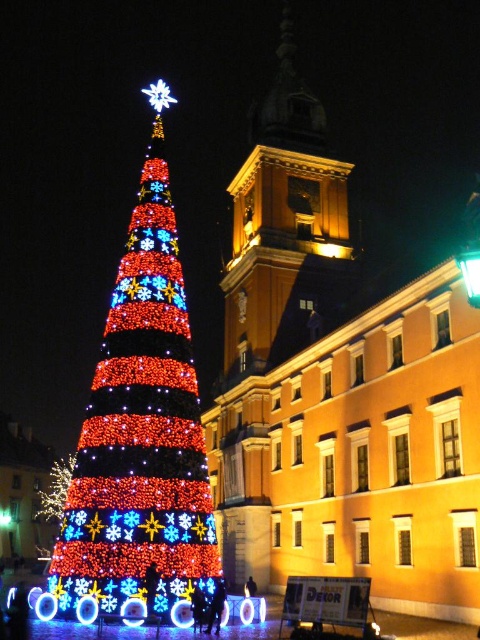
Measure the distance between golden stone bell tower at upper center and illuminated plastic tree at center.

golden stone bell tower at upper center and illuminated plastic tree at center are 66.75 meters apart from each other.

The height and width of the screenshot is (640, 480). Describe the element at coordinates (286, 227) in the screenshot. I see `golden stone bell tower at upper center` at that location.

You are a GUI agent. You are given a task and a screenshot of the screen. Output one action in this format:
    pyautogui.click(x=<x>, y=<y>)
    Task: Click on the golden stone bell tower at upper center
    The width and height of the screenshot is (480, 640).
    Given the screenshot: What is the action you would take?
    pyautogui.click(x=286, y=227)

Image resolution: width=480 pixels, height=640 pixels. What do you see at coordinates (141, 432) in the screenshot?
I see `illuminated fabric christmas tree at left` at bounding box center [141, 432].

From the picture: Does illuminated fabric christmas tree at left appear under illuminated plastic tree at center?

No.

Which is behind, point (140, 500) or point (48, 502)?

Positioned behind is point (48, 502).

Where is `illuminated fabric christmas tree at left`? Image resolution: width=480 pixels, height=640 pixels. illuminated fabric christmas tree at left is located at coordinates (141, 432).

Between point (141, 273) and point (288, 289), which one is positioned in front?

Point (141, 273) is more forward.

Between illuminated fabric christmas tree at left and golden stone bell tower at upper center, which one has less height?

illuminated fabric christmas tree at left

Which is in front, point (171, 544) or point (297, 99)?

Positioned in front is point (171, 544).

Image resolution: width=480 pixels, height=640 pixels. In order to click on illuminated fabric christmas tree at left in this screenshot , I will do `click(141, 432)`.